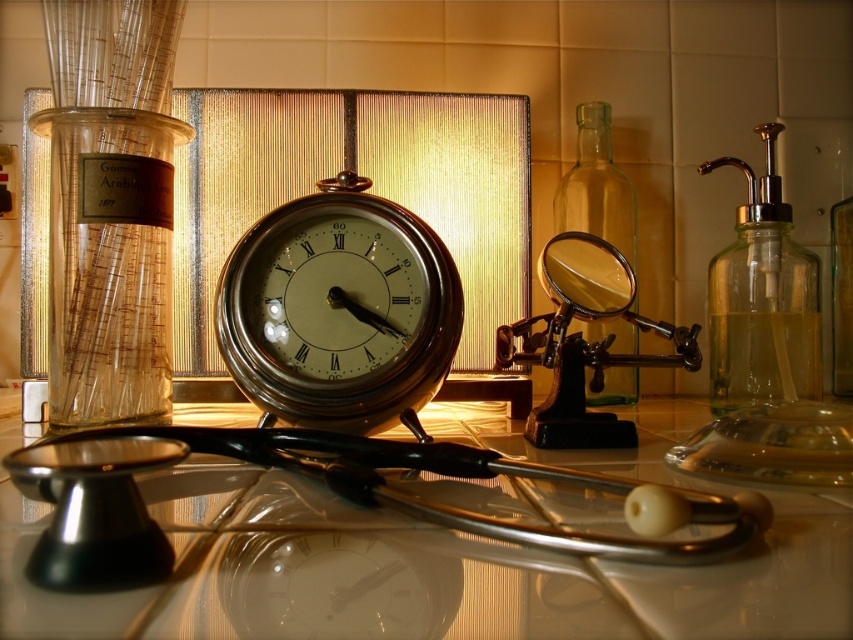
Question: Which point is farther to the camera?

Choices:
 (A) clear glass soap dispenser at right
 (B) shiny brass clock at center

Answer: (A)

Question: Which of the following is the closest to the observer?

Choices:
 (A) clear glass soap dispenser at right
 (B) glossy glass stethoscope at center
 (C) transparent glass bottle at center-right

Answer: (B)

Question: Is clear glass soap dispenser at right wider than transparent glass bottle at center-right?

Choices:
 (A) no
 (B) yes

Answer: (B)

Question: In this image, where is glossy glass stethoscope at center located relative to transparent glass cylinder at left?

Choices:
 (A) right
 (B) left

Answer: (A)

Question: Is glossy glass stethoscope at center to the left of clear glass soap dispenser at right from the viewer's perspective?

Choices:
 (A) yes
 (B) no

Answer: (A)

Question: Which object is the closest to the transparent glass bottle at center-right?

Choices:
 (A) shiny brass clock at center
 (B) clear glass soap dispenser at right

Answer: (B)